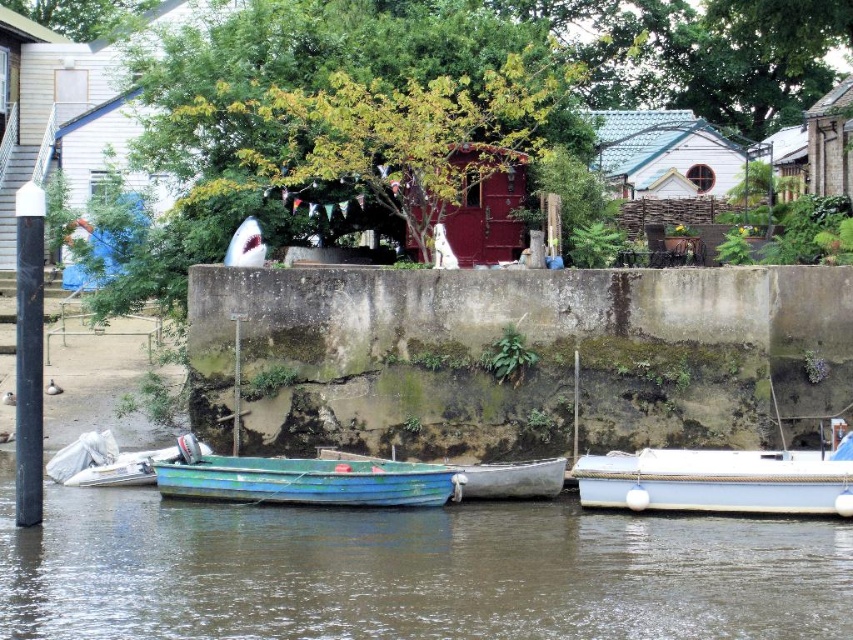
Question: Is blue matte boat at center behind rustic wooden hut at center?

Choices:
 (A) yes
 (B) no

Answer: (B)

Question: Which point is closer to the camera taking this photo?

Choices:
 (A) (799, 499)
 (B) (180, 472)

Answer: (A)

Question: Can you confirm if white matte hut at upper center is positioned above rustic wooden hut at center?

Choices:
 (A) yes
 (B) no

Answer: (A)

Question: Which of the following is the closest to the observer?

Choices:
 (A) (743, 504)
 (B) (817, 109)
 (C) (436, 502)

Answer: (A)

Question: Does blue matte boat at center have a lesser width compared to wooden hut at upper right?

Choices:
 (A) yes
 (B) no

Answer: (B)

Question: Which point is farther to the camera?

Choices:
 (A) white matte hut at upper center
 (B) wooden hut at upper right
 (C) rustic wooden hut at center

Answer: (B)